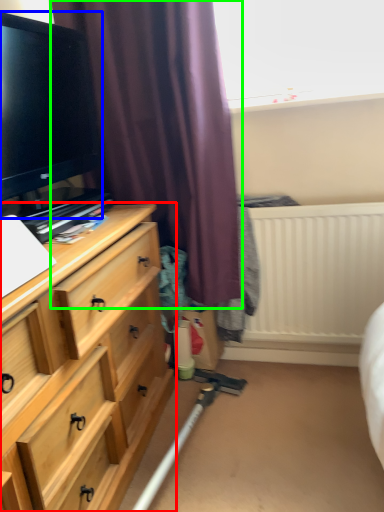
Question: Based on their relative distances, which object is nearer to chest of drawers (highlighted by a red box)? Choose from television (highlighted by a blue box) and curtain (highlighted by a green box).

Choices:
 (A) television
 (B) curtain

Answer: (B)